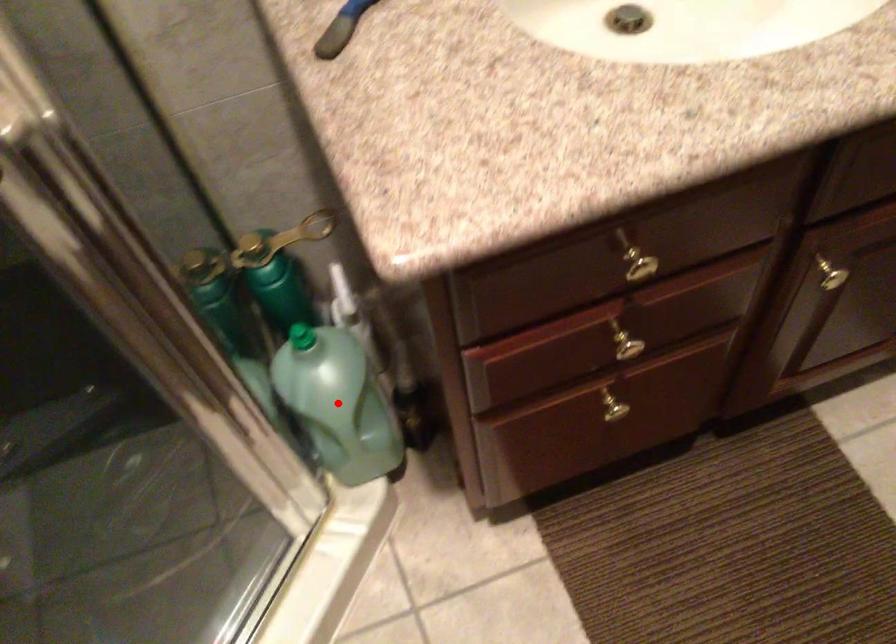
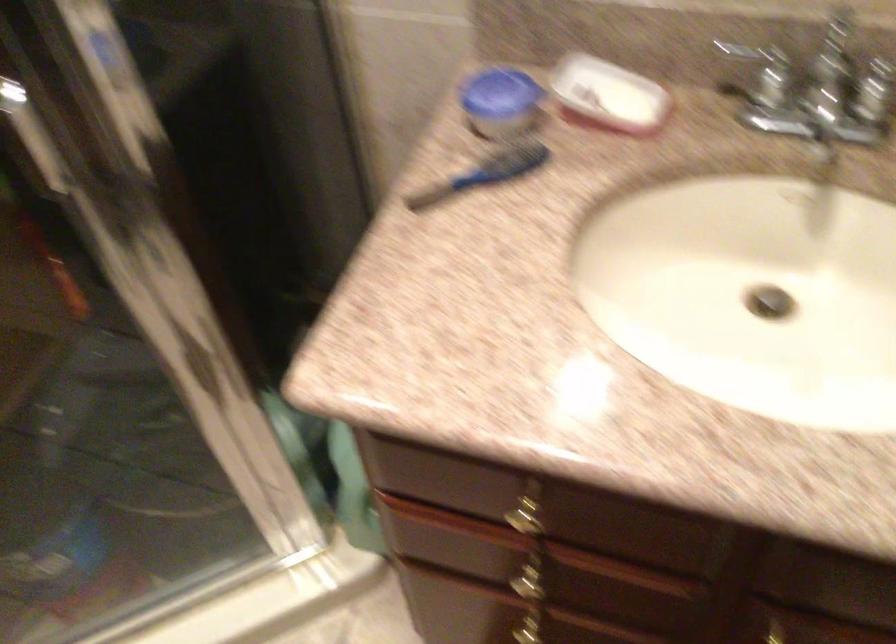
Question: I am providing you with two images of the same scene from different viewpoints. A red point is marked on the first image. Can you still see the location of the red point in image 2?

Choices:
 (A) Yes
 (B) No

Answer: (B)